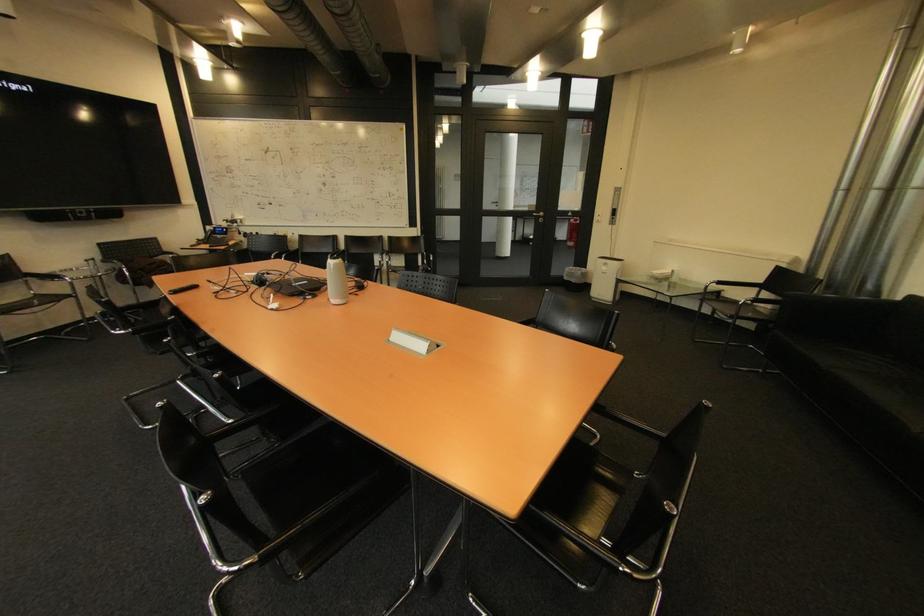
Identify the location of red fire extinguisher. (572, 232).